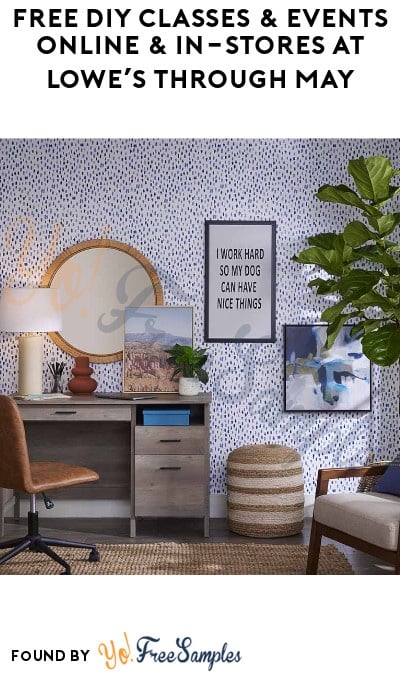
You are a GUI agent. You are given a task and a screenshot of the screen. Output one action in this format:
    pyautogui.click(x=<x>, y=<y>)
    Task: Click on the mirror
    
    Given the screenshot: What is the action you would take?
    pyautogui.click(x=96, y=297)